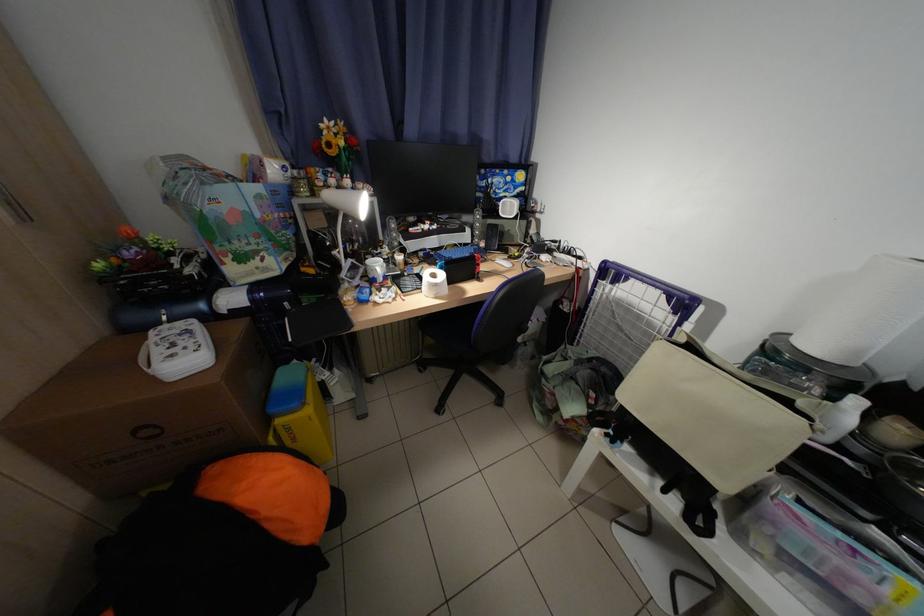
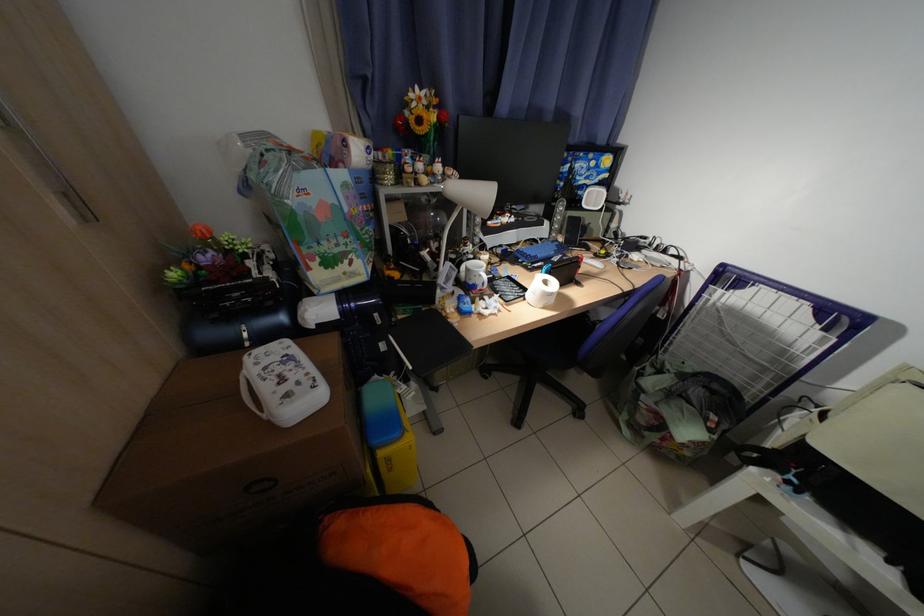
In a continuous first-person perspective shot, in which direction is the camera moving?

The movement direction of the cameraman is left, forward.